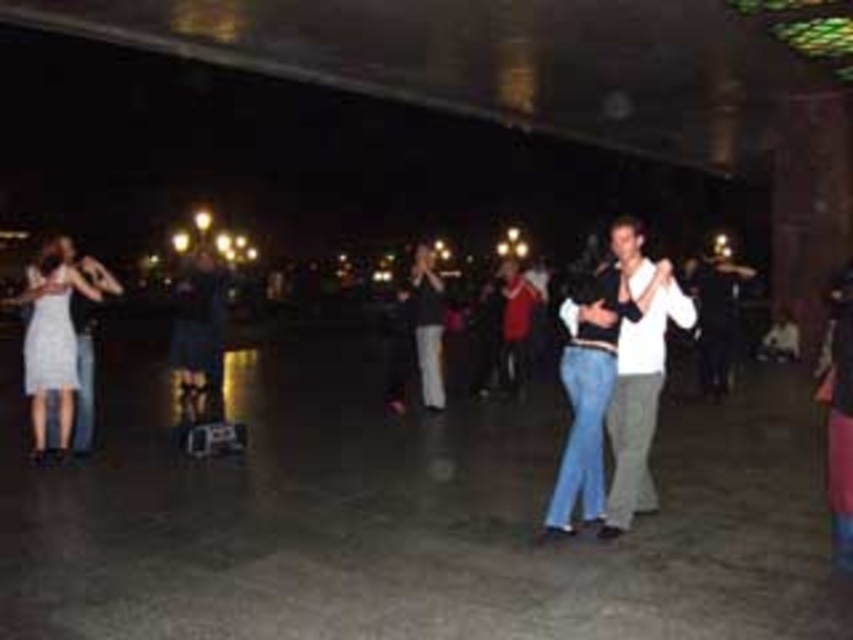
From the picture: You are at a nighttime plaza where people are dancing. You see a white matte shirt at center and a matte black dress at center. Which one is positioned more to the right side?

The white matte shirt at center is to the right of the matte black dress at center, so the white matte shirt at center is positioned more to the right side.

You are planning to buy a dress for a party. You see two dresses in the image, the matte white dress at left and the matte black dress at center. Which dress is bigger in size?

The matte white dress at left has a larger size compared to the matte black dress at center.